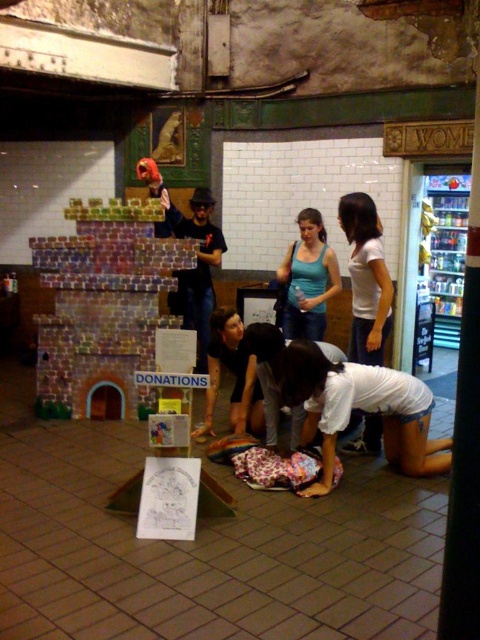
Does multicolored cardboard castle at left appear over white matte shirt at center?

No, multicolored cardboard castle at left is not above white matte shirt at center.

Does multicolored cardboard castle at left appear under white matte shirt at center?

Correct, multicolored cardboard castle at left is located below white matte shirt at center.

Measure the distance between point (133, 209) and camera.

Point (133, 209) is 4.52 meters away from camera.

The width and height of the screenshot is (480, 640). In order to click on multicolored cardboard castle at left in this screenshot , I will do `click(101, 301)`.

Is multicolored cardboard castle at left wider than matte blue tank top at center?

Correct, the width of multicolored cardboard castle at left exceeds that of matte blue tank top at center.

Does point (134, 355) lie behind point (313, 211)?

No, it is in front of (313, 211).

Is point (151, 243) farther from viewer compared to point (321, 273)?

No, (151, 243) is closer to viewer.

You are a GUI agent. You are given a task and a screenshot of the screen. Output one action in this format:
    pyautogui.click(x=<x>, y=<y>)
    Task: Click on the multicolored cardboard castle at left
    This screenshot has height=640, width=480.
    Given the screenshot: What is the action you would take?
    pyautogui.click(x=101, y=301)

Based on the photo, who is more distant from viewer, (367, 227) or (286, 260)?

The point (286, 260) is behind.

Locate an element on the screen. white matte shirt at center is located at coordinates (365, 278).